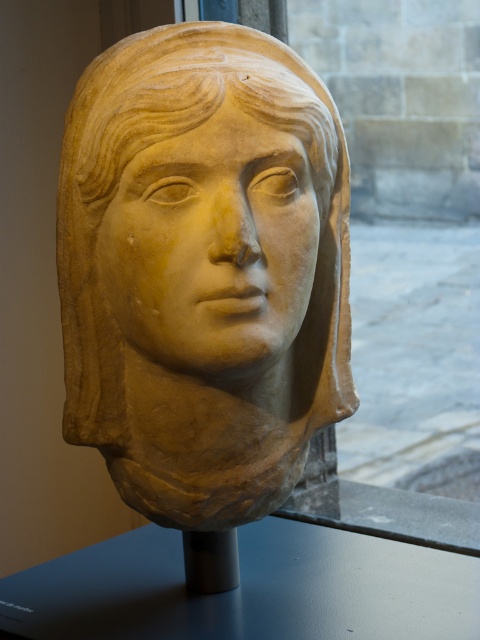
You are an art conservator examining the beige stone bust at center and the smooth beige stone face at center in the museum. Which object is located above the other?

The smooth beige stone face at center is positioned above the beige stone bust at center.

You are an art student standing in front of the beige stone bust at center and the smooth beige stone face at center. Which object is closer to you?

The beige stone bust at center is closer to you than the smooth beige stone face at center.